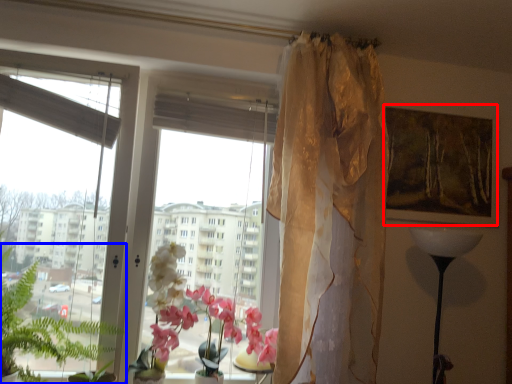
Question: Which object appears farthest to the camera in this image, picture frame (highlighted by a red box) or vegetation (highlighted by a blue box)?

Choices:
 (A) picture frame
 (B) vegetation

Answer: (A)